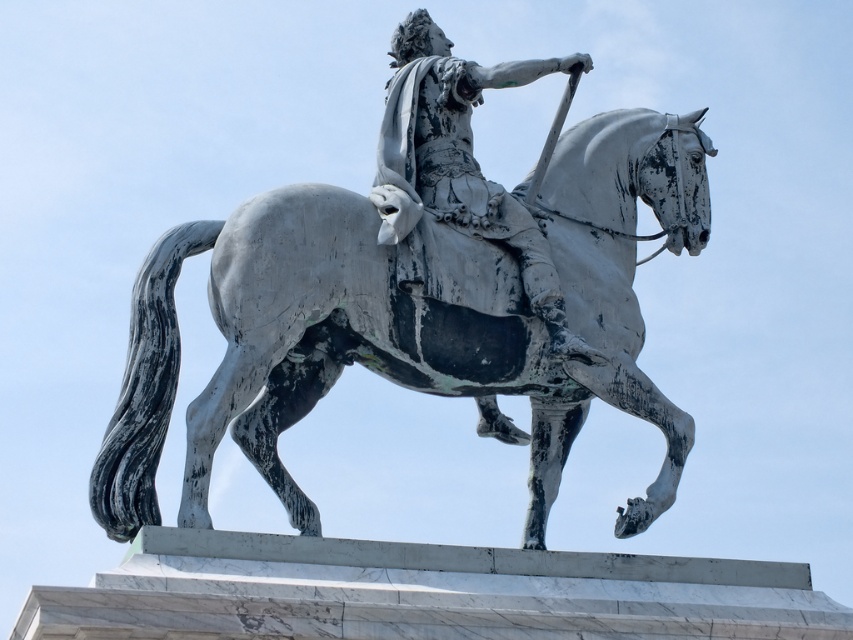
You are standing in front of the equestrian statue and want to touch the point at coordinates point (569, 294). Can you reach it without moving closer?

The point (569, 294) is 87.55 meters away from the viewer, so you cannot reach it without moving closer.

You are an art student analyzing the statue. You observe the white weathered horse at center and the bronze statue at center. Which object is taller?

The white weathered horse at center is much taller than the bronze statue at center.

You are a photographer standing at a certain distance from the white weathered horse at center. You want to capture a full view of the statue without any cropping. Given that your camera has a standard lens with a focal length of 50mm, what is the minimum distance you need to be from the horse to ensure the entire statue fits in the frame?

The minimum distance required is 77.39 meters to ensure the entire white weathered horse at center fits within the camera frame.